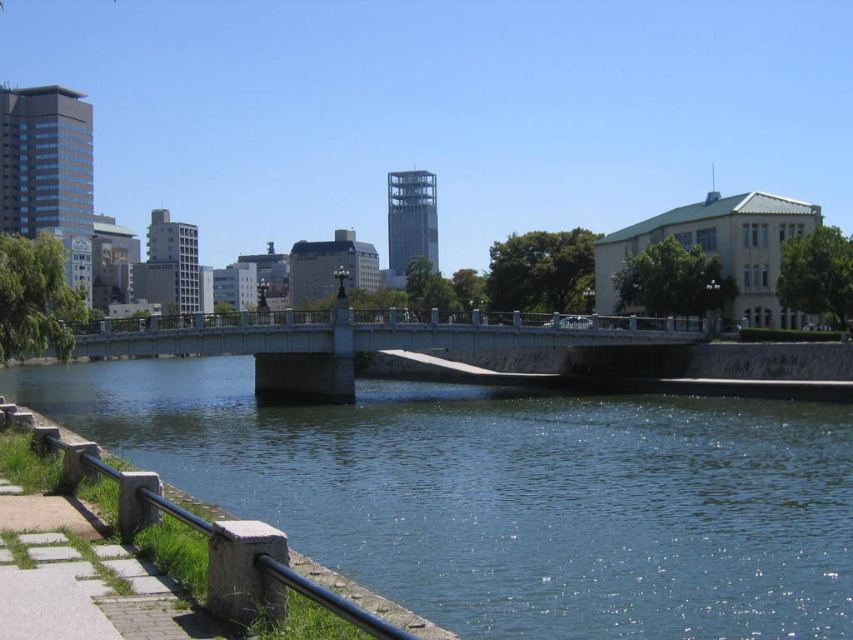
Question: Does smooth concrete bridge at center appear on the left side of stone textured rail at lower left?

Choices:
 (A) no
 (B) yes

Answer: (B)

Question: Which of the following is the farthest from the observer?

Choices:
 (A) (236, 316)
 (B) (215, 564)
 (C) (293, 413)

Answer: (A)

Question: Is smooth concrete bridge at center positioned at the back of stone textured rail at lower left?

Choices:
 (A) no
 (B) yes

Answer: (B)

Question: Estimate the real-world distances between objects in this image. Which object is closer to the clear blue water at center?

Choices:
 (A) smooth concrete bridge at center
 (B) stone textured rail at lower left

Answer: (A)

Question: Which object is the farthest from the stone textured rail at lower left?

Choices:
 (A) clear blue water at center
 (B) smooth concrete bridge at center

Answer: (B)

Question: Is smooth concrete bridge at center in front of stone textured rail at lower left?

Choices:
 (A) yes
 (B) no

Answer: (B)